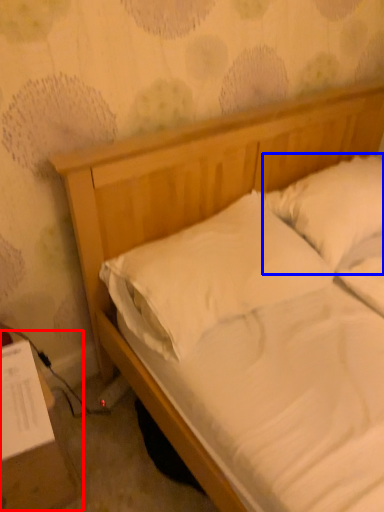
Question: Which object is closer to the camera taking this photo, table (highlighted by a red box) or pillow (highlighted by a blue box)?

Choices:
 (A) table
 (B) pillow

Answer: (A)